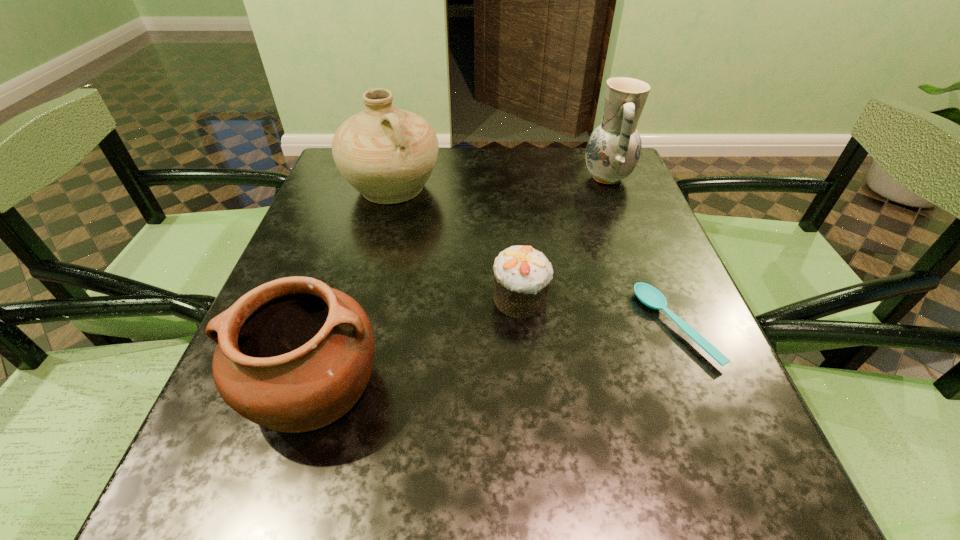
Identify the location of free region at the far right corner. This screenshot has width=960, height=540. (609, 184).

Locate an element on the screen. This screenshot has width=960, height=540. vacant area between the spoon and the fourth tallest object is located at coordinates (598, 312).

You are a GUI agent. You are given a task and a screenshot of the screen. Output one action in this format:
    pyautogui.click(x=<x>, y=<y>)
    Task: Click on the vacant space that is in between the second shortest object and the rightmost pottery
    This screenshot has width=960, height=540.
    Given the screenshot: What is the action you would take?
    pyautogui.click(x=564, y=238)

Locate an element on the screen. This screenshot has width=960, height=540. vacant space that's between the third tallest object and the rightmost pottery is located at coordinates (460, 281).

Locate an element on the screen. The width and height of the screenshot is (960, 540). vacant area that lies between the spoon and the nearest pottery is located at coordinates (494, 356).

Image resolution: width=960 pixels, height=540 pixels. Identify the location of vacant region between the cupcake and the rightmost pottery. (564, 238).

At what (x,y) coordinates should I click in order to perform the action: click on empty location between the shortest object and the third object from left to right. Please return your answer as a coordinate pair (x, y). The width and height of the screenshot is (960, 540). Looking at the image, I should click on (598, 312).

Identify which object is located as the third nearest to the cupcake. Please provide its 2D coordinates. Your answer should be formatted as a tuple, i.e. [(x, y)], where the tuple contains the x and y coordinates of a point satisfying the conditions above.

[(387, 154)]

Locate an element on the screen. Image resolution: width=960 pixels, height=540 pixels. the fourth closest object to the second shortest object is located at coordinates (613, 150).

The height and width of the screenshot is (540, 960). I want to click on pottery object that ranks as the closest to the rightmost pottery, so click(387, 154).